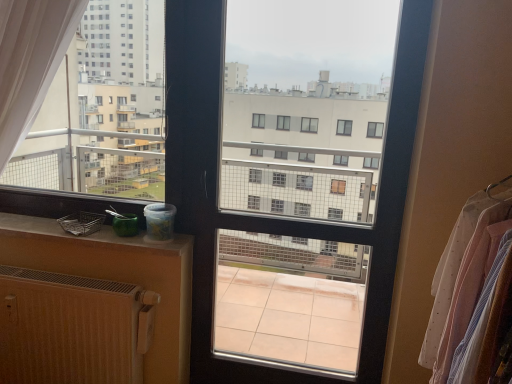
Locate an element on the screen. Image resolution: width=512 pixels, height=384 pixels. empty space that is ontop of wooden radiator at lower left (from a real-world perspective) is located at coordinates (45, 271).